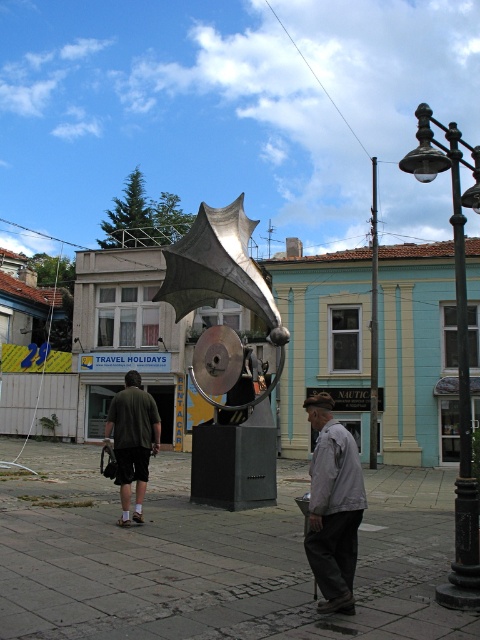
Question: Among these points, which one is nearest to the camera?

Choices:
 (A) [x=322, y=531]
 (B) [x=425, y=131]
 (C) [x=127, y=506]
 (D) [x=376, y=374]

Answer: (A)

Question: Is shiny metallic sculpture at center to the left of black metal streetlight at right from the viewer's perspective?

Choices:
 (A) no
 (B) yes

Answer: (B)

Question: Which point appears farthest from the camera in this image?

Choices:
 (A) (201, 433)
 (B) (132, 390)
 (C) (372, 330)
 (D) (343, 508)

Answer: (C)

Question: Which point appears closest to the camera in this image?

Choices:
 (A) (466, 497)
 (B) (131, 460)

Answer: (A)

Question: Is shiny metallic sculpture at center to the left of metallic pole at center from the viewer's perspective?

Choices:
 (A) yes
 (B) no

Answer: (A)

Question: Considering the relative positions of shiny metallic sculpture at center and light gray fabric jacket at center in the image provided, where is shiny metallic sculpture at center located with respect to light gray fabric jacket at center?

Choices:
 (A) right
 (B) left

Answer: (B)